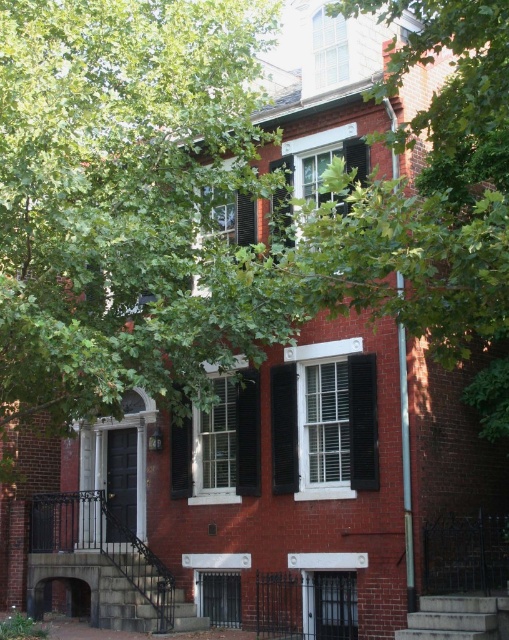
In the scene shown: You are standing in front of the three story brick building and want to locate the black matte shutters at center. According to the coordinates provided, where exactly would you find them?

The black matte shutters at center are located at point (343,420).

You are standing in front of the three story brick building and want to know which of the two points, point (279, 468) or point (232, 416), is closer to you. Can you determine this based on their positions?

Point (279, 468) is closer to the viewer than point (232, 416).